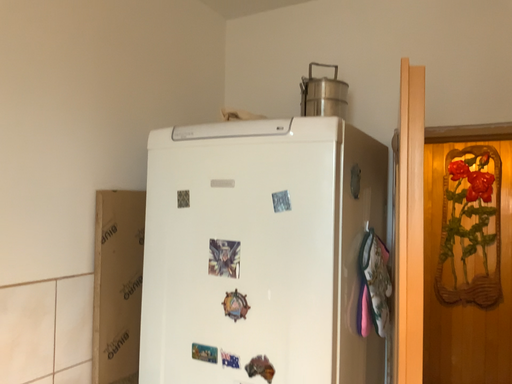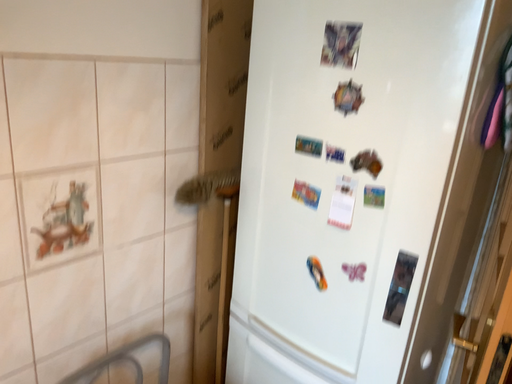
Question: Which way did the camera rotate in the video?

Choices:
 (A) rotated left
 (B) rotated right

Answer: (A)